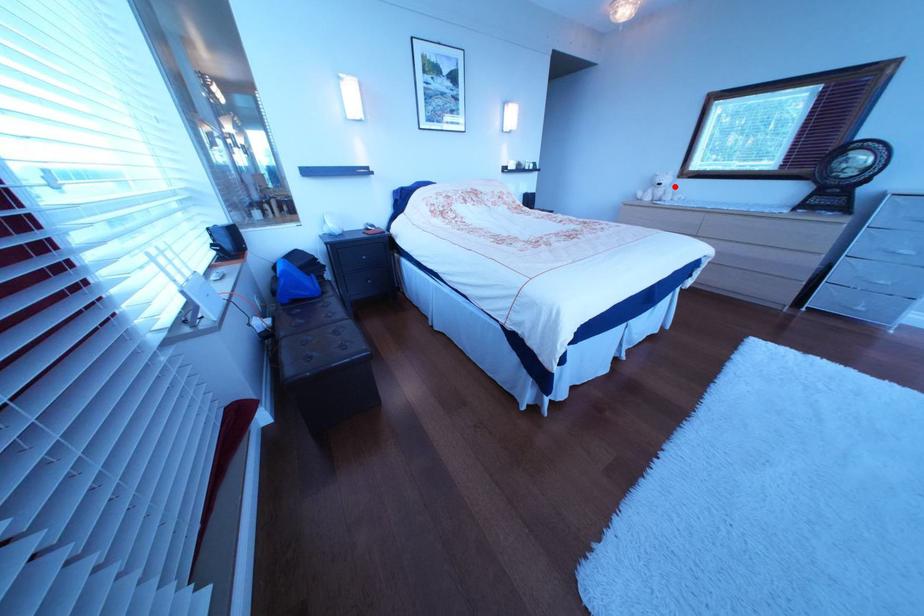
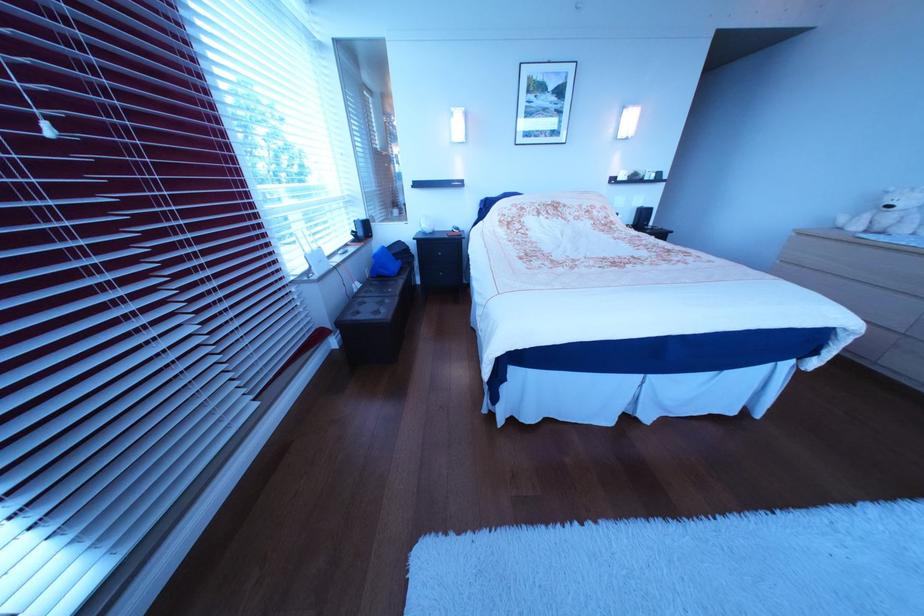
In the second image, find the point that corresponds to the highlighted location in the first image.

(906, 209)